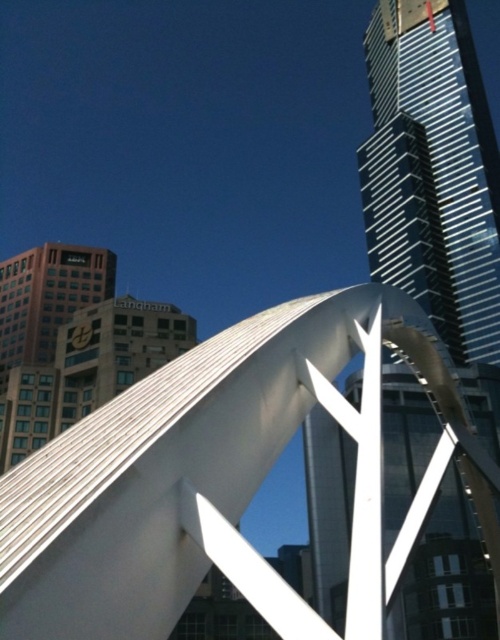
Can you confirm if white polished metal sculpture at center is positioned above polished glass skyscraper at center?

Incorrect, white polished metal sculpture at center is not positioned above polished glass skyscraper at center.

Based on the photo, is white polished metal sculpture at center wider than polished glass skyscraper at center?

In fact, white polished metal sculpture at center might be narrower than polished glass skyscraper at center.

This screenshot has width=500, height=640. In order to click on white polished metal sculpture at center in this screenshot , I will do `click(221, 477)`.

Locate an element on the screen. white polished metal sculpture at center is located at coordinates (221, 477).